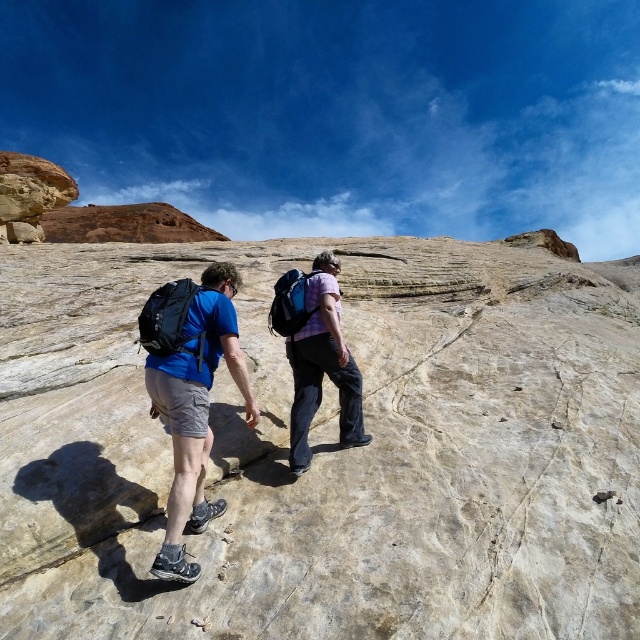
Question: Can you confirm if matte blue shirt at center is positioned below plaid shirt at center?

Choices:
 (A) no
 (B) yes

Answer: (B)

Question: Can you confirm if matte blue shirt at center is smaller than matte black backpack at center?

Choices:
 (A) yes
 (B) no

Answer: (A)

Question: Does matte black backpack at center appear on the right side of plaid shirt at center?

Choices:
 (A) no
 (B) yes

Answer: (A)

Question: Estimate the real-world distances between objects in this image. Which object is farther from the matte black backpack at center?

Choices:
 (A) plaid shirt at center
 (B) matte blue shirt at center

Answer: (A)

Question: Among these objects, which one is farthest from the camera?

Choices:
 (A) matte blue shirt at center
 (B) plaid shirt at center
 (C) matte black backpack at center

Answer: (B)

Question: Based on their relative distances, which object is nearer to the matte blue shirt at center?

Choices:
 (A) plaid shirt at center
 (B) matte black backpack at center

Answer: (B)